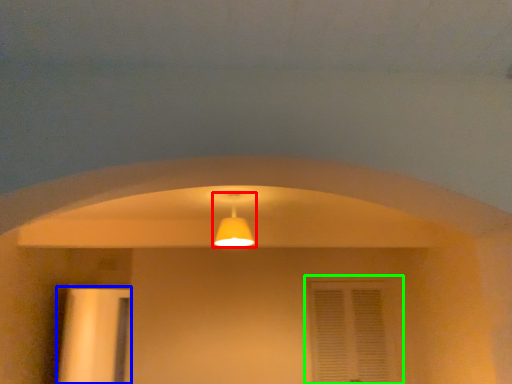
Question: Which object is the closest to the lamp (highlighted by a red box)? Choose among these: door (highlighted by a blue box) or window (highlighted by a green box).

Choices:
 (A) door
 (B) window

Answer: (B)